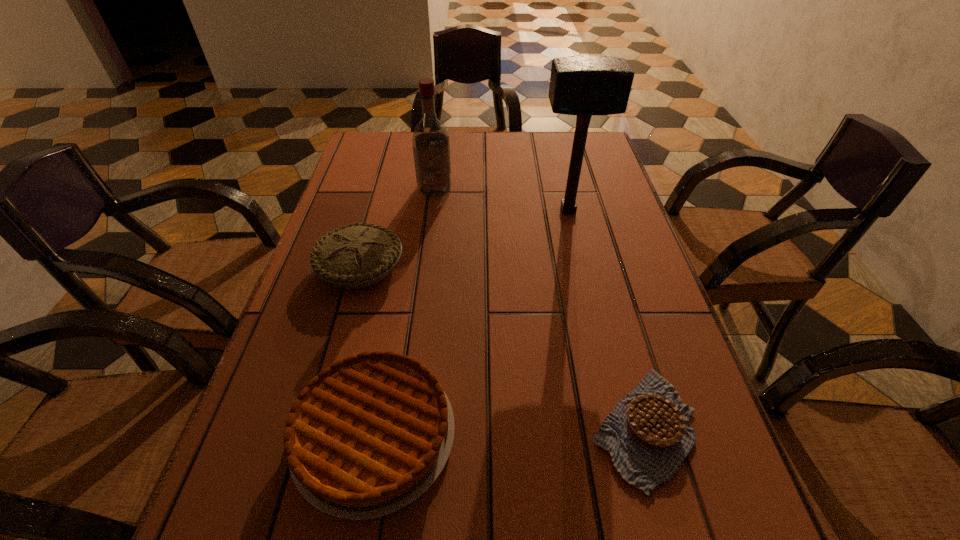
Locate an element on the screen. mallet is located at coordinates (584, 86).

The width and height of the screenshot is (960, 540). In order to click on the second farthest object in this screenshot , I will do `click(584, 86)`.

Identify the location of liquor. The height and width of the screenshot is (540, 960). (431, 148).

Find the location of a particular element. The height and width of the screenshot is (540, 960). the second tallest object is located at coordinates (431, 148).

The height and width of the screenshot is (540, 960). Identify the location of the third nearest object. (359, 255).

Identify the location of the shortest object. (648, 434).

I want to click on the shortest pie, so click(x=648, y=434).

Where is `free space located on the left of the mallet`? free space located on the left of the mallet is located at coordinates (482, 210).

Image resolution: width=960 pixels, height=540 pixels. What are the coordinates of `vacant space located 0.060m on the front-facing side of the liquor` in the screenshot? It's located at (432, 210).

I want to click on vacant space positioned on the front of the third farthest object, so click(297, 497).